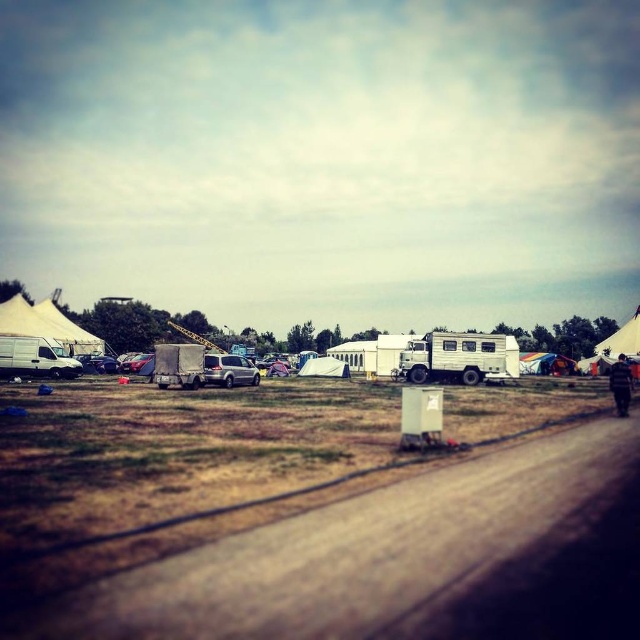
You are planning to set up a picnic blanket in the camping area. You want to ensure it stays dry if it rains. Which object should you place your picnic blanket under to avoid rain, the matte white van at left or the white canvas tent at right?

The white canvas tent at right is designed to provide shelter from rain, so placing the picnic blanket under the white canvas tent at right would keep it dry.